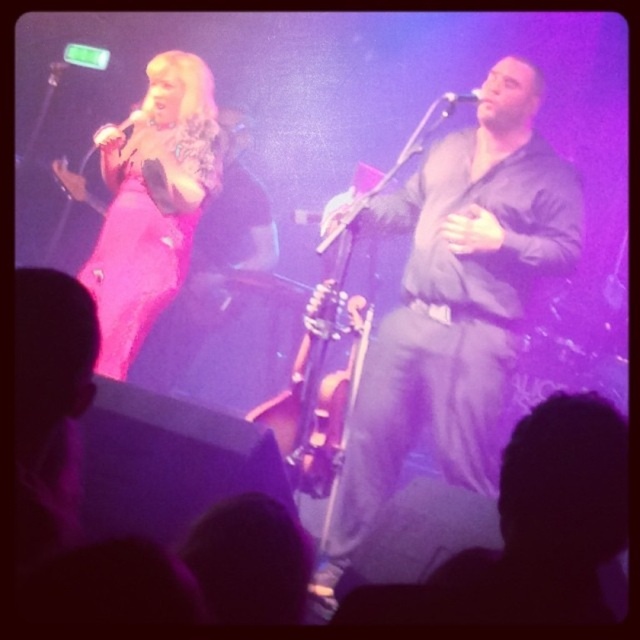
You are a photographer at the concert venue, and you need to capture a clear shot of both the shiny pink dress at upper left and the metallic silver microphone at upper left. Based on their positions, which object should you focus on first to ensure it appears in focus in the photo?

The shiny pink dress at upper left is much taller than the metallic silver microphone at upper left, so you should focus on the shiny pink dress at upper left first to ensure it appears in focus.